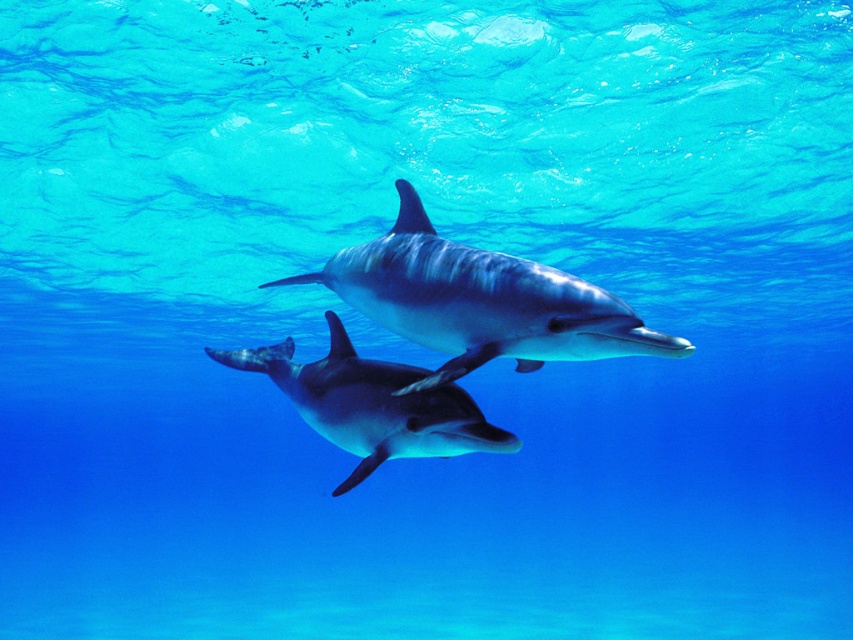
Question: Is smooth gray dolphin at center further to camera compared to glossy blue dolphin at center?

Choices:
 (A) no
 (B) yes

Answer: (A)

Question: Which point is farther from the camera taking this photo?

Choices:
 (A) (498, 259)
 (B) (459, 448)

Answer: (A)

Question: Which point appears farthest from the camera in this image?

Choices:
 (A) (550, 308)
 (B) (369, 360)

Answer: (B)

Question: Does smooth gray dolphin at center have a lesser width compared to glossy blue dolphin at center?

Choices:
 (A) no
 (B) yes

Answer: (A)

Question: Is smooth gray dolphin at center smaller than glossy blue dolphin at center?

Choices:
 (A) no
 (B) yes

Answer: (A)